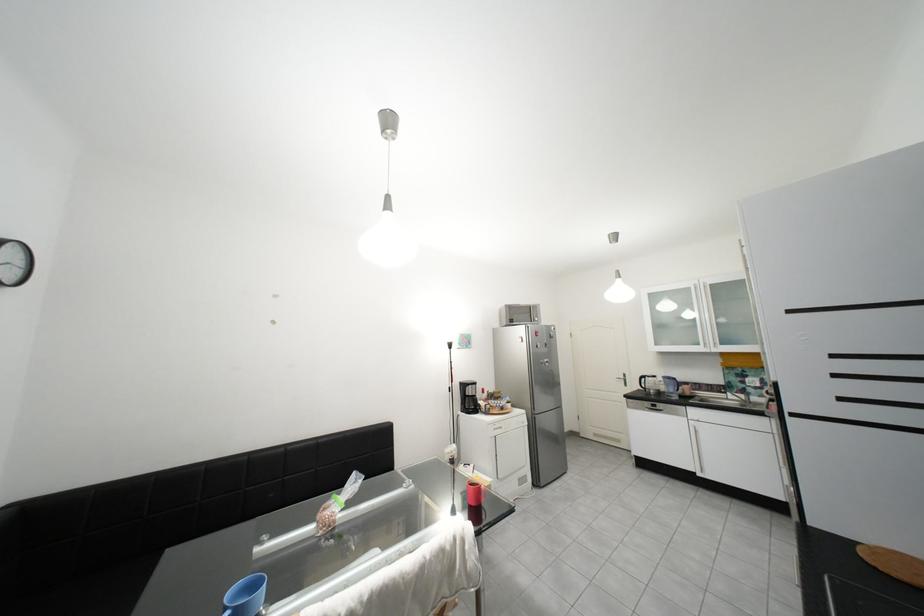
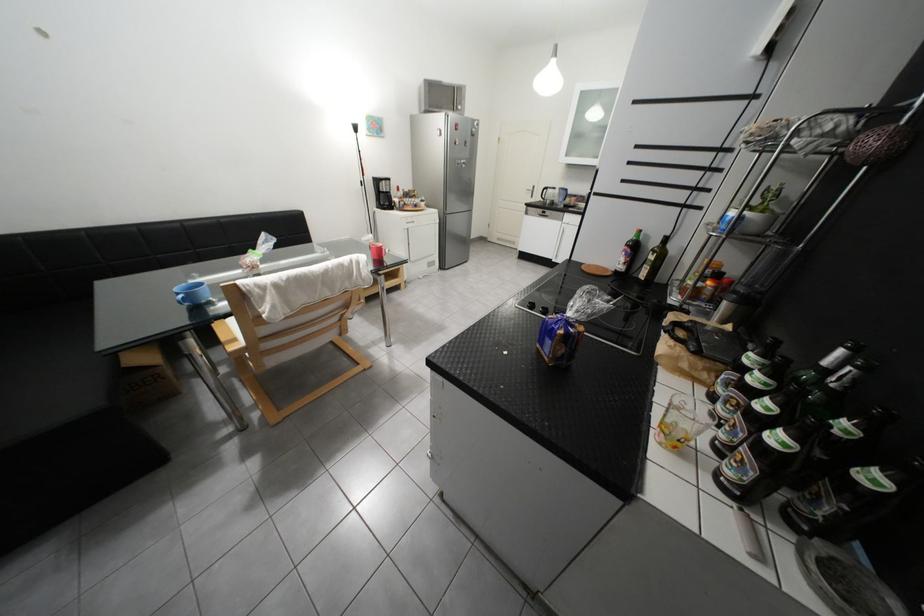
Locate, in the second image, the point that corresponds to point 637,376 in the first image.

(545, 188)